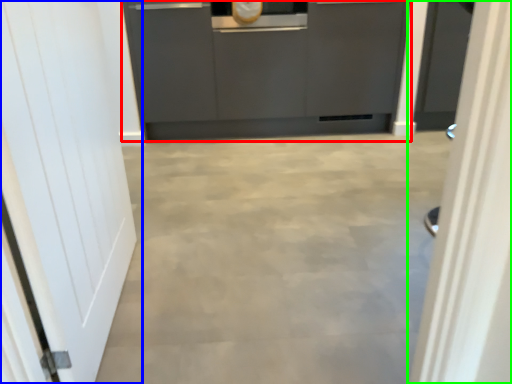
Question: Considering the real-world distances, which object is closest to cabinetry (highlighted by a red box)? door (highlighted by a blue box) or door (highlighted by a green box).

Choices:
 (A) door
 (B) door

Answer: (A)